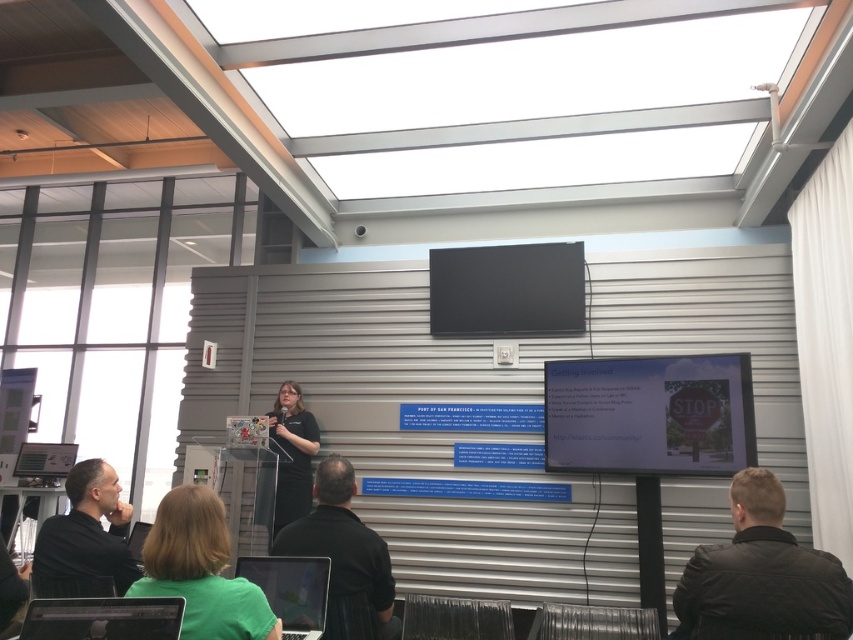
Based on the photo, who is higher up, matte white projection screen at center or matte black laptop at lower center?

matte white projection screen at center is above.

Is matte white projection screen at center below matte black laptop at lower center?

Incorrect, matte white projection screen at center is not positioned below matte black laptop at lower center.

Who is more distant from viewer, [554,422] or [312,577]?

Positioned behind is point [554,422].

The width and height of the screenshot is (853, 640). I want to click on matte white projection screen at center, so click(x=648, y=413).

Can you confirm if matte black laptop at lower left is wider than black matte shirt at center?

Yes.

Which is above, matte black laptop at lower left or black matte shirt at center?

Positioned higher is matte black laptop at lower left.

Between point (80, 624) and point (281, 464), which one is positioned behind?

The point (281, 464) is more distant.

Locate an element on the screen. matte black laptop at lower left is located at coordinates (103, 618).

Is black leather jacket at lower right smaller than black matte screen at upper center?

Yes.

Does black leather jacket at lower right have a larger size compared to black matte screen at upper center?

No.

Does point (753, 528) come behind point (498, 282)?

No.

The width and height of the screenshot is (853, 640). Find the location of `black leather jacket at lower right`. black leather jacket at lower right is located at coordinates (761, 577).